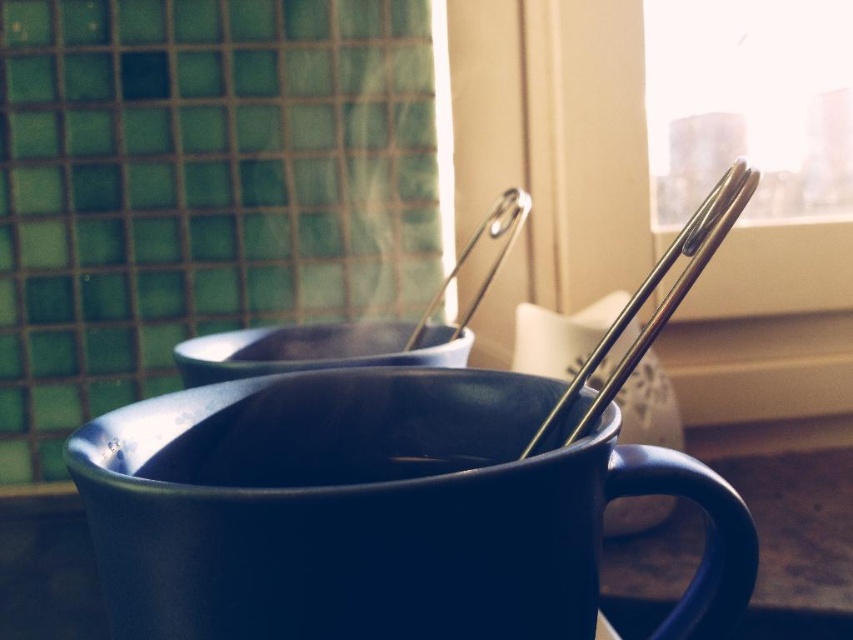
Looking at this image, you have two mugs on a table in front of you. One is the glossy ceramic mug at center and the other is the matte black mug at center. You need to pour both into a container that can only hold the volume of the smaller mug. Which mug should you pour first to avoid spilling?

You should pour the matte black mug at center first because it is smaller than the glossy ceramic mug at center, so pouring it first ensures that the container can hold its contents without overflowing before adding the larger mug.

You have a small container that can only hold items narrower than the silver metallic chopstick at upper center. Can the matte black mug at center fit into it?

The matte black mug at center is wider than the silver metallic chopstick at upper center, so it cannot fit into the container designed for items narrower than the chopstick.

You are setting up a table for a tea ceremony. You have a matte black mug at center and a silver metallic chopstick at upper center. Which object would you need to adjust if you want the chopstick to be fully visible above the mug?

The matte black mug at center is smaller than the silver metallic chopstick at upper center, so you would need to adjust the position of the mug to ensure the chopstick is fully visible above it.